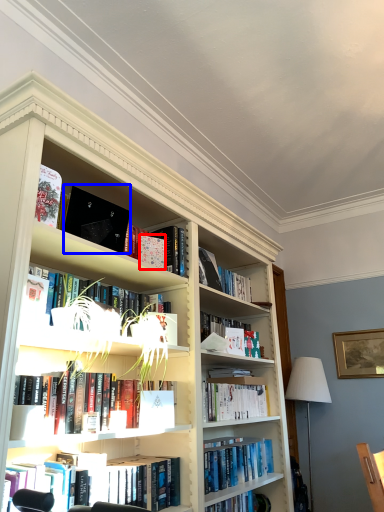
Question: Which object is closer to the camera taking this photo, paperback book (highlighted by a red box) or paperback book (highlighted by a blue box)?

Choices:
 (A) paperback book
 (B) paperback book

Answer: (B)